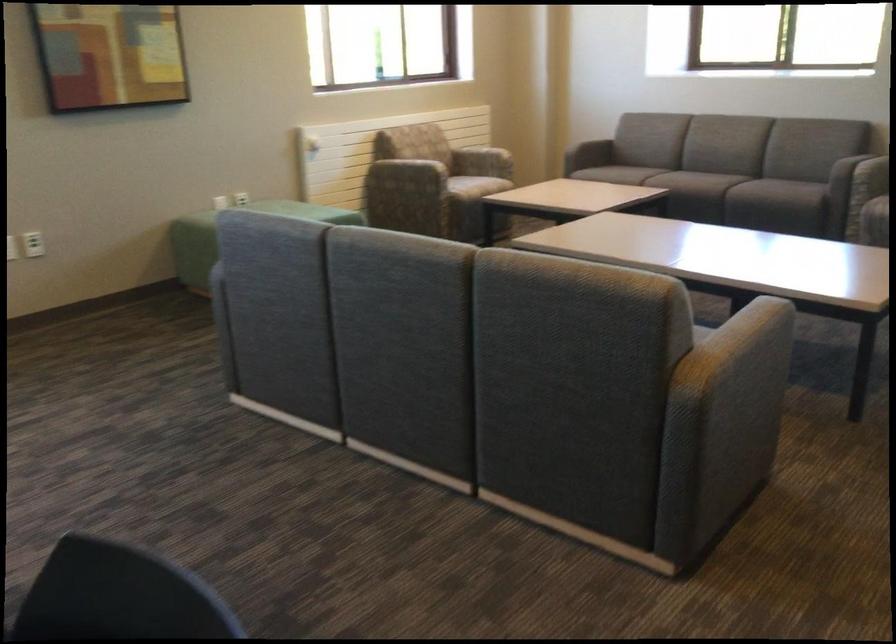
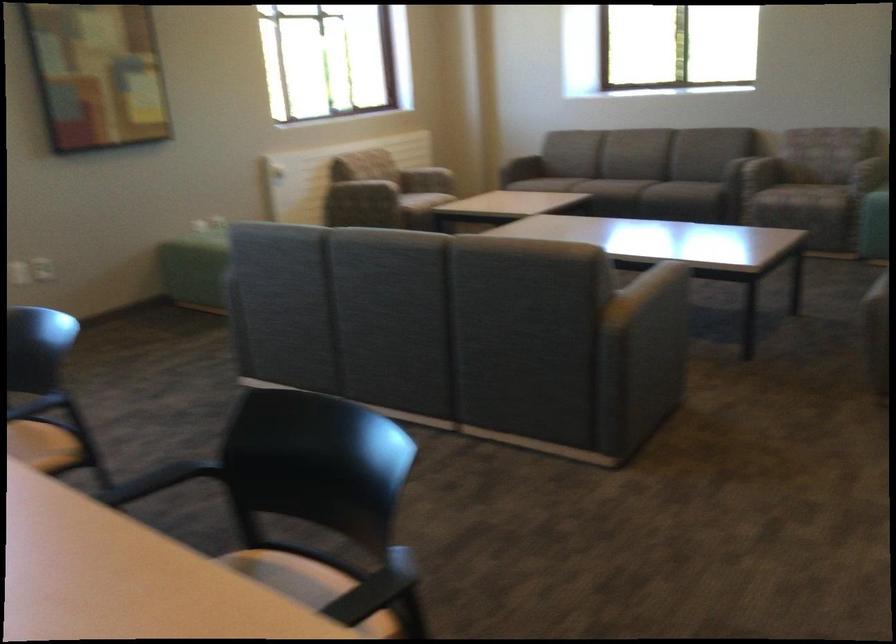
Locate, in the second image, the point that corresponds to [590,158] in the first image.

(522, 167)